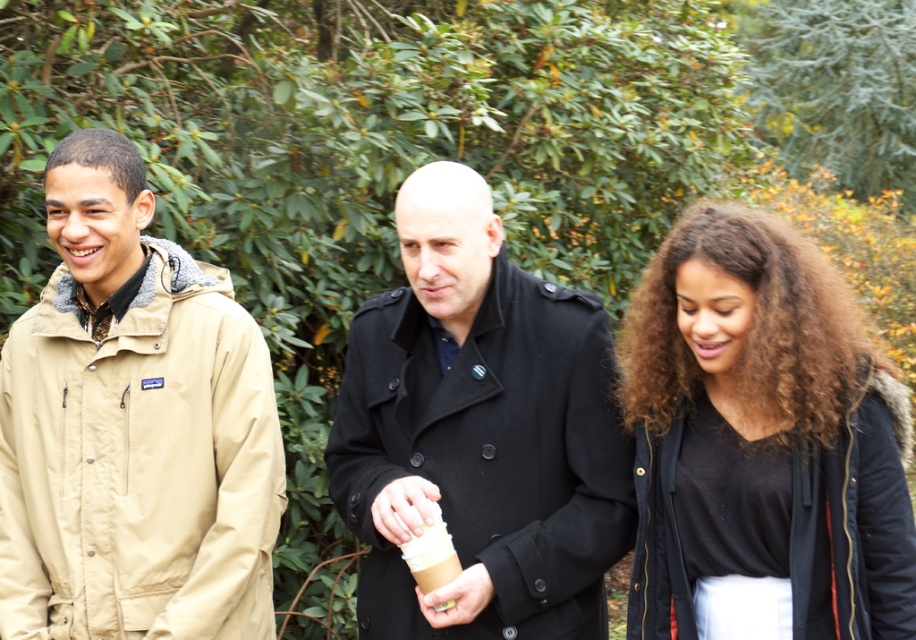
You are a photographer trying to capture a group photo of the black matte jacket at right and the brown paper cup at center. Since you want to highlight the size difference between them, which object should you place closer to the camera to emphasize their relative sizes?

To emphasize the size difference between the black matte jacket at right and the brown paper cup at center, you should place the brown paper cup at center closer to the camera. Since the black matte jacket at right is wider than the brown paper cup at center, positioning the narrower object closer will make it appear larger in comparison, thereby highlighting the size contrast between them.

You are a photographer trying to capture a candid shot of the brown paper cup at center without including the tan fabric jacket at left. Given their current positions, is this possible?

The tan fabric jacket at left is positioned over the brown paper cup at center, so it would block the direct line of sight. Therefore, capturing the cup without the jacket in the frame would require adjusting the angle or moving the subjects.